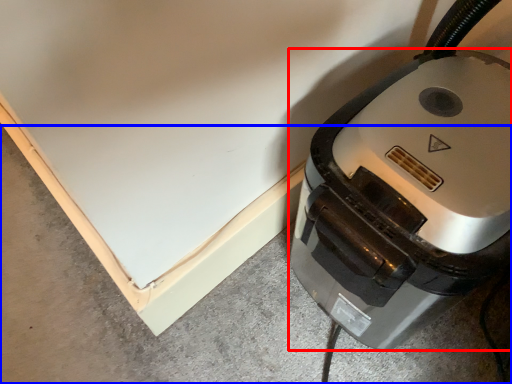
Question: Which point is closer to the camera, home appliance (highlighted by a red box) or concrete (highlighted by a blue box)?

Choices:
 (A) home appliance
 (B) concrete

Answer: (A)